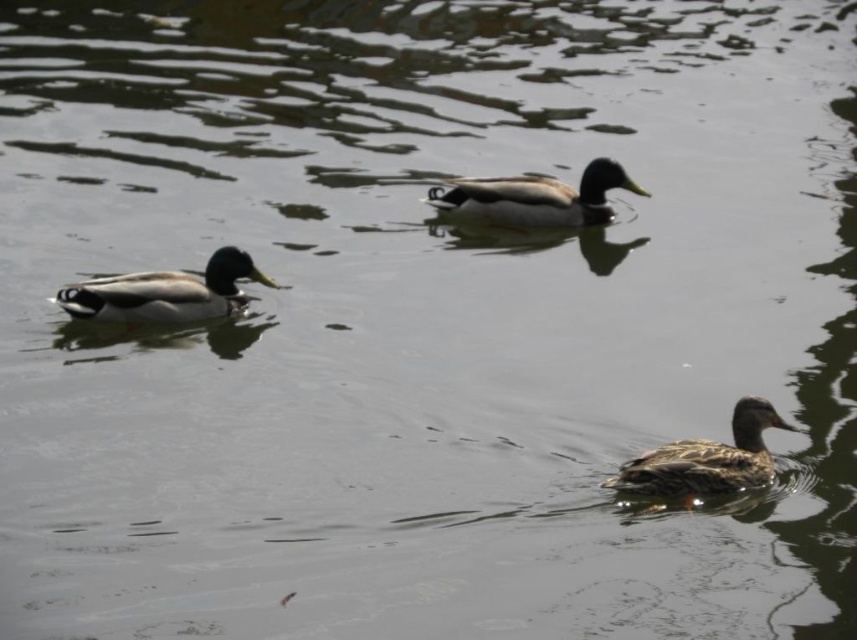
Question: Which of the following is the closest to the observer?

Choices:
 (A) brown speckled duck at lower right
 (B) green glossy duck at left

Answer: (A)

Question: Is green glossy duck at left wider than green glossy duck at center?

Choices:
 (A) yes
 (B) no

Answer: (B)

Question: Is the position of green glossy duck at left more distant than that of green glossy duck at center?

Choices:
 (A) no
 (B) yes

Answer: (A)

Question: Which object is positioned closest to the green glossy duck at center?

Choices:
 (A) green glossy duck at left
 (B) brown speckled duck at lower right

Answer: (A)

Question: Does brown speckled duck at lower right appear over green glossy duck at left?

Choices:
 (A) no
 (B) yes

Answer: (A)

Question: Which point is farther to the camera?

Choices:
 (A) (114, 308)
 (B) (702, 440)
 (C) (480, 205)

Answer: (C)